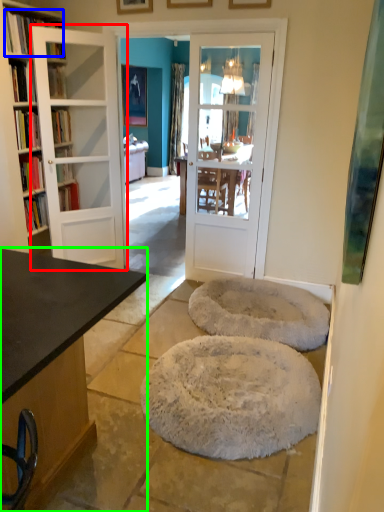
Question: Which object is positioned farthest from door (highlighted by a red box)? Select from book (highlighted by a blue box) and desk (highlighted by a green box).

Choices:
 (A) book
 (B) desk

Answer: (B)